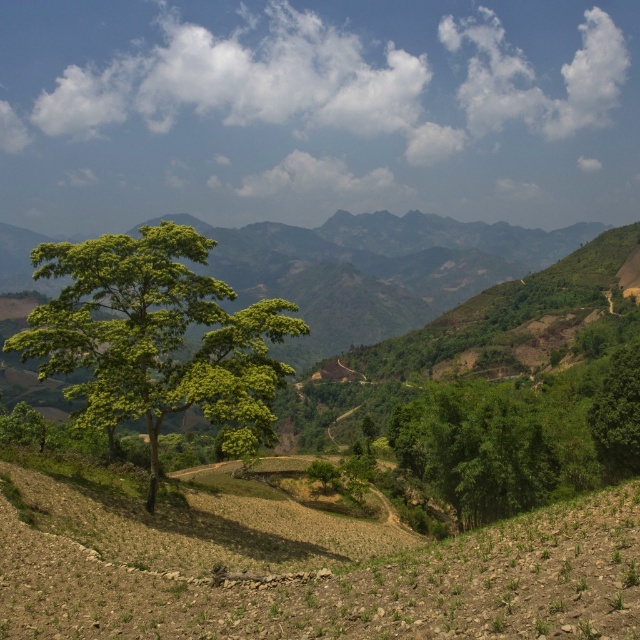
The width and height of the screenshot is (640, 640). Describe the element at coordinates (156, 337) in the screenshot. I see `green leafy tree at center` at that location.

At what (x,y) coordinates should I click in order to perform the action: click on green leafy tree at center. Please return your answer as a coordinate pair (x, y). This screenshot has width=640, height=640. Looking at the image, I should click on (156, 337).

The image size is (640, 640). What are the coordinates of `green leafy tree at center` in the screenshot? It's located at (156, 337).